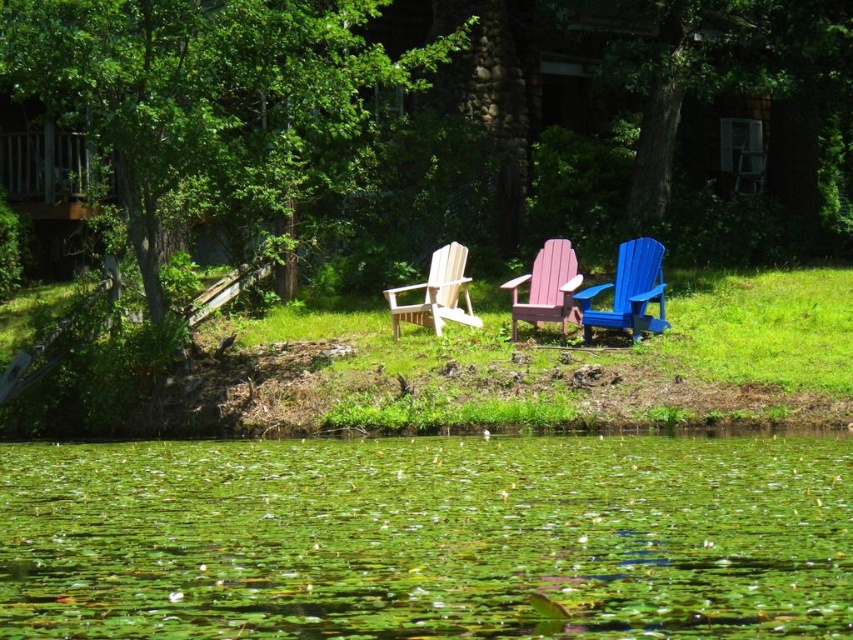
Question: Which point is closer to the camera?

Choices:
 (A) (816, 480)
 (B) (469, 307)

Answer: (A)

Question: Does green leafy water at lower center appear on the right side of blue plastic beach chair at center?

Choices:
 (A) no
 (B) yes

Answer: (A)

Question: Among these points, which one is farthest from the camera?

Choices:
 (A) click(x=527, y=321)
 (B) click(x=448, y=269)
 (C) click(x=120, y=532)
 (D) click(x=662, y=248)

Answer: (B)

Question: Does green leafy water at lower center appear on the right side of pink wood beach chair at center?

Choices:
 (A) no
 (B) yes

Answer: (A)

Question: Observing the image, what is the correct spatial positioning of pink wood beach chair at center in reference to light wood beach chair at center?

Choices:
 (A) below
 (B) above

Answer: (B)

Question: Which of these objects is positioned closest to the green leafy water at lower center?

Choices:
 (A) light wood beach chair at center
 (B) pink wood beach chair at center
 (C) blue plastic beach chair at center

Answer: (C)